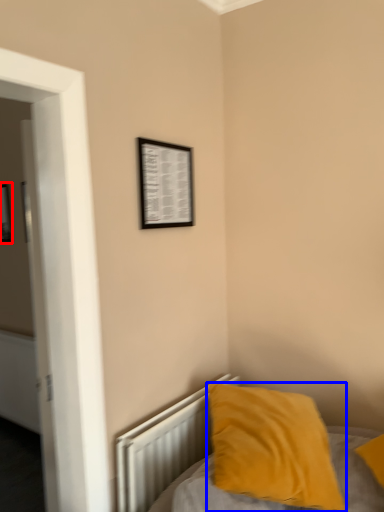
Question: Which object is further to the camera taking this photo, picture frame (highlighted by a red box) or pillow (highlighted by a blue box)?

Choices:
 (A) picture frame
 (B) pillow

Answer: (A)